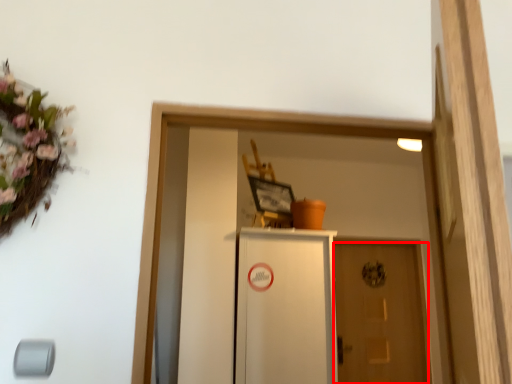
Question: Observing the image, what is the correct spatial positioning of door (annotated by the red box) in reference to cabinetry?

Choices:
 (A) left
 (B) right

Answer: (B)